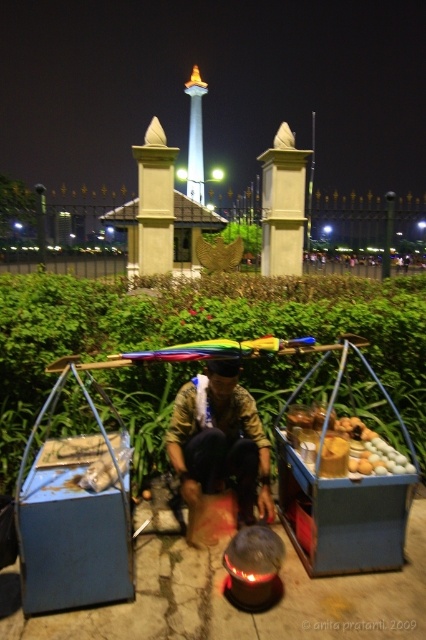
Question: Which point is farther to the camera?

Choices:
 (A) pyautogui.click(x=189, y=157)
 (B) pyautogui.click(x=230, y=365)

Answer: (A)

Question: Considering the real-world distances, which object is closest to the camouflage fabric at center?

Choices:
 (A) shiny glass tower at center
 (B) smooth wooden tray at center

Answer: (B)

Question: Which object appears closest to the camera in this image?

Choices:
 (A) shiny glass tower at center
 (B) camouflage fabric at center

Answer: (B)

Question: Is smooth wooden tray at center above shiny glass tower at center?

Choices:
 (A) yes
 (B) no

Answer: (B)

Question: Can you confirm if camouflage fabric at center is positioned below smooth wooden tray at center?

Choices:
 (A) no
 (B) yes

Answer: (B)

Question: Is camouflage fabric at center further to camera compared to smooth wooden tray at center?

Choices:
 (A) yes
 (B) no

Answer: (A)